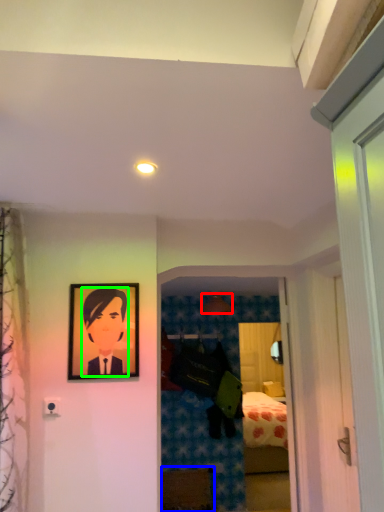
Question: Which object is positioned farthest from lamp (highlighted by a red box)? Select from furniture (highlighted by a blue box) and person (highlighted by a green box).

Choices:
 (A) furniture
 (B) person

Answer: (B)